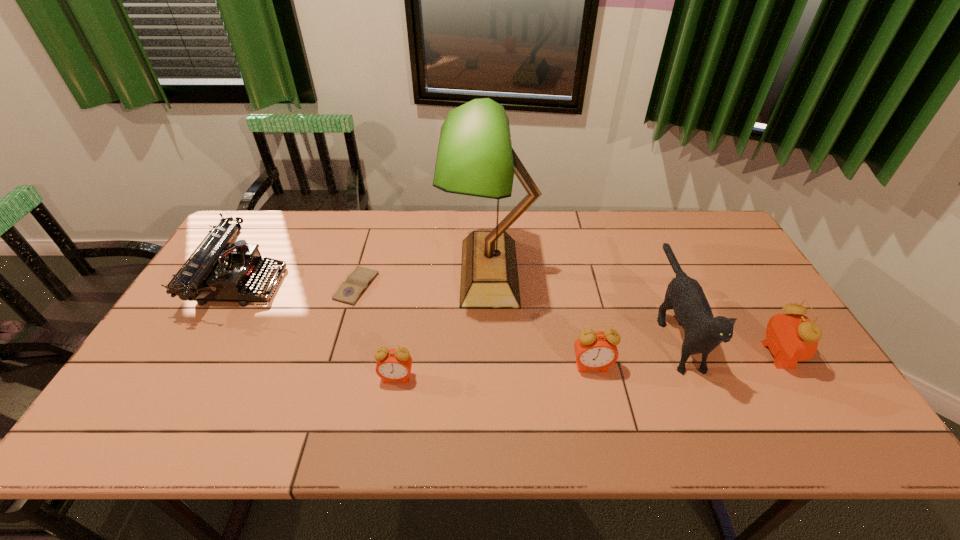
You are a GUI agent. You are given a task and a screenshot of the screen. Output one action in this format:
    pyautogui.click(x=<x>, y=<y>)
    Task: Click on the second closest alarm clock to the shortest alarm clock
    The image size is (960, 540).
    Given the screenshot: What is the action you would take?
    pyautogui.click(x=793, y=337)

Image resolution: width=960 pixels, height=540 pixels. I want to click on free spot that satisfies the following two spatial constraints: 1. on the face of the rightmost alarm clock; 2. on the face of the leftmost alarm clock, so click(792, 378).

This screenshot has height=540, width=960. What are the coordinates of `free space that satisfies the following two spatial constraints: 1. on the face of the rightmost object; 2. on the face of the second alarm clock from left to right` in the screenshot? It's located at (785, 366).